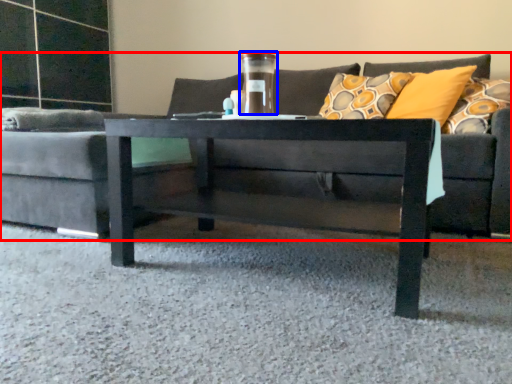
Question: Which point is closer to the camera, studio couch (highlighted by a red box) or glass vase (highlighted by a blue box)?

Choices:
 (A) studio couch
 (B) glass vase

Answer: (A)